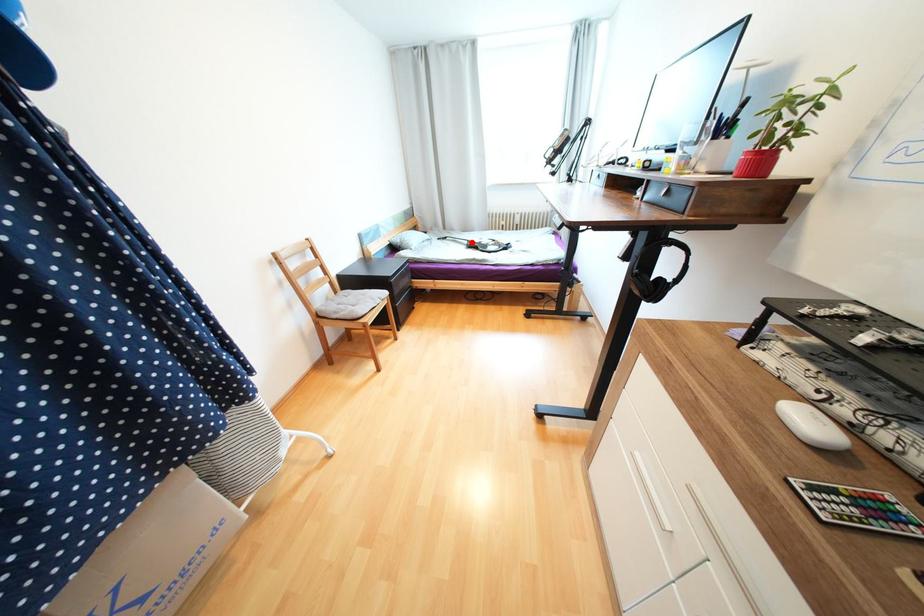
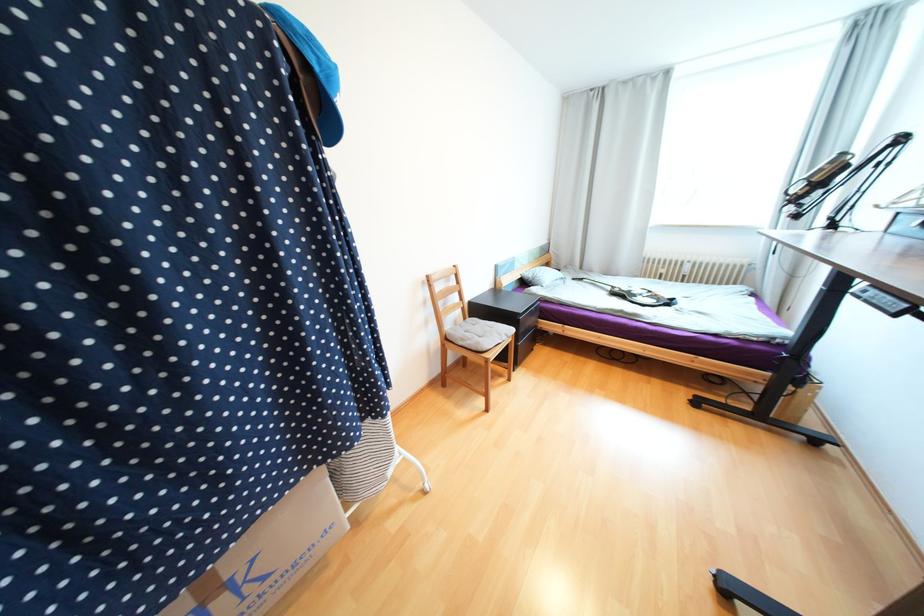
The point at the highlighted location is marked in the first image. Where is the corresponding point in the second image?

(614, 288)